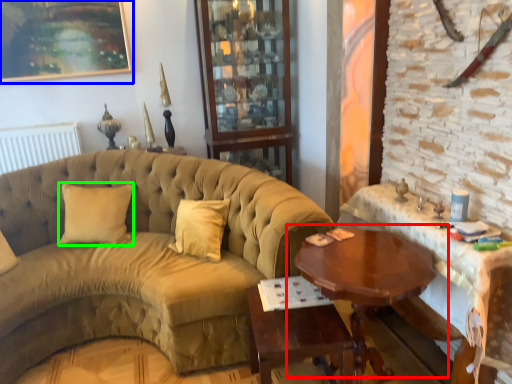
Question: Which is nearer to the table (highlighted by a red box)? picture frame (highlighted by a blue box) or pillow (highlighted by a green box).

Choices:
 (A) picture frame
 (B) pillow

Answer: (B)